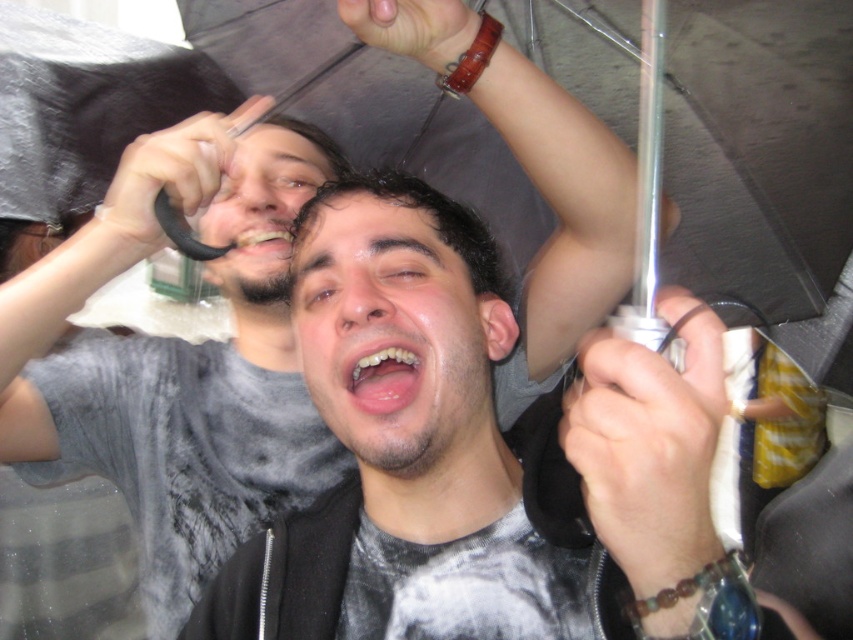
You are trying to identify the position of the transparent plastic umbrella at center and the matte gray shirt at left in the image. Which object is located to the right side?

The transparent plastic umbrella at center is located to the right of the matte gray shirt at left.

What are the coordinates of the transparent plastic umbrella at center?

The transparent plastic umbrella at center is located at coordinates point (759, 148).